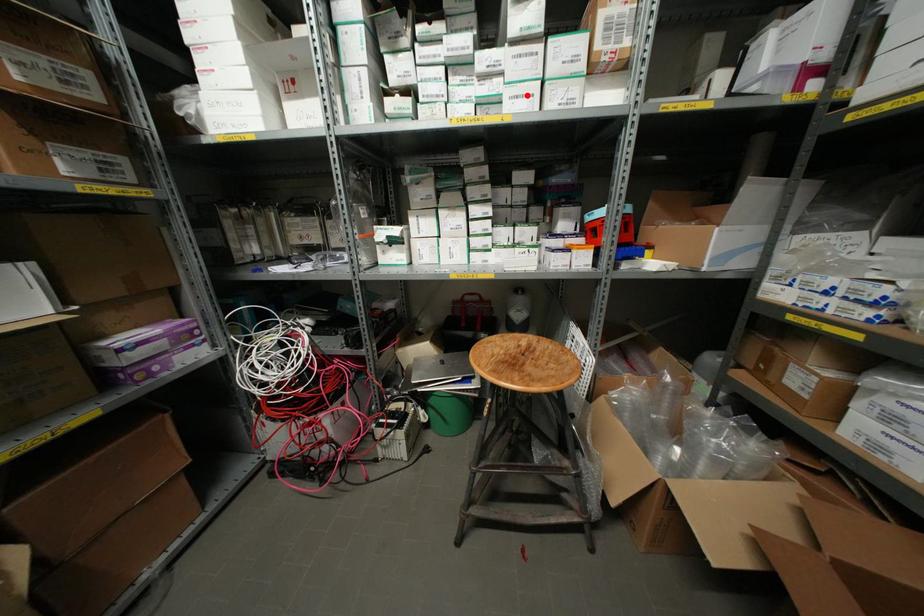
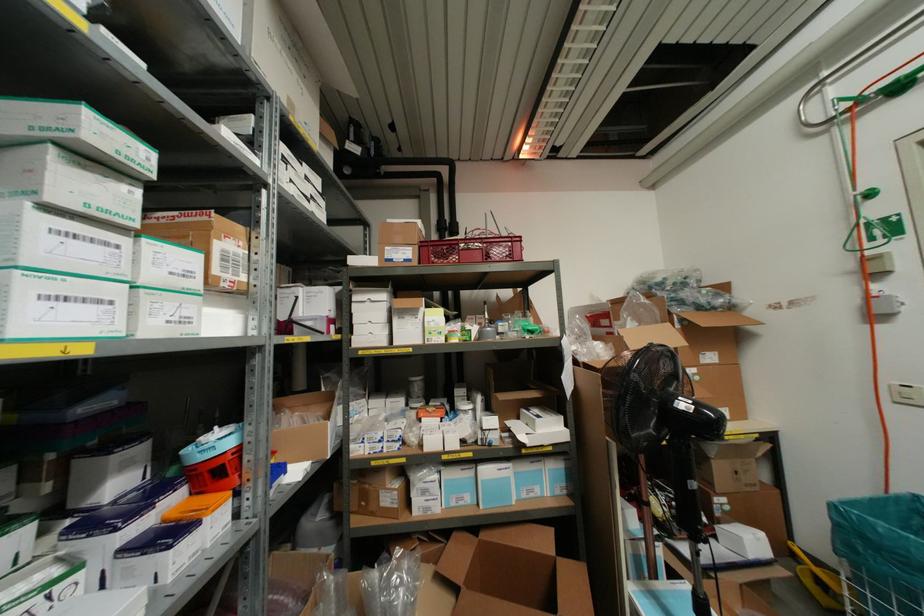
Where in the second image is the point corresponding to the highlighted location from the first image?

(98, 301)